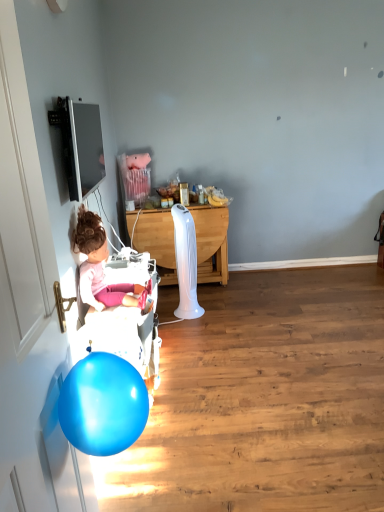
Question: Is the depth of white plastic baby carriage at left less than that of white glossy door at left?

Choices:
 (A) no
 (B) yes

Answer: (A)

Question: Does white plastic baby carriage at left have a greater width compared to white glossy door at left?

Choices:
 (A) no
 (B) yes

Answer: (B)

Question: Would you say white glossy door at left is part of white plastic baby carriage at left's contents?

Choices:
 (A) no
 (B) yes

Answer: (A)

Question: From a real-world perspective, is white plastic baby carriage at left beneath white glossy door at left?

Choices:
 (A) no
 (B) yes

Answer: (B)

Question: Is white plastic baby carriage at left outside of white glossy door at left?

Choices:
 (A) no
 (B) yes

Answer: (B)

Question: Does white plastic baby carriage at left have a smaller size compared to white glossy door at left?

Choices:
 (A) no
 (B) yes

Answer: (A)

Question: From the image's perspective, does white wood desk at center appear lower than matte pink doll at left?

Choices:
 (A) no
 (B) yes

Answer: (A)

Question: Is white wood desk at center looking in the opposite direction of matte pink doll at left?

Choices:
 (A) yes
 (B) no

Answer: (B)

Question: Can you confirm if white wood desk at center is positioned to the right of matte pink doll at left?

Choices:
 (A) yes
 (B) no

Answer: (A)

Question: Is white wood desk at center further to the viewer compared to matte pink doll at left?

Choices:
 (A) no
 (B) yes

Answer: (B)

Question: Does white wood desk at center have a lesser width compared to matte pink doll at left?

Choices:
 (A) yes
 (B) no

Answer: (B)

Question: From a real-world perspective, is white wood desk at center physically above matte pink doll at left?

Choices:
 (A) no
 (B) yes

Answer: (A)

Question: Can you confirm if white glossy door at left is positioned to the left of matte pink doll at left?

Choices:
 (A) no
 (B) yes

Answer: (A)